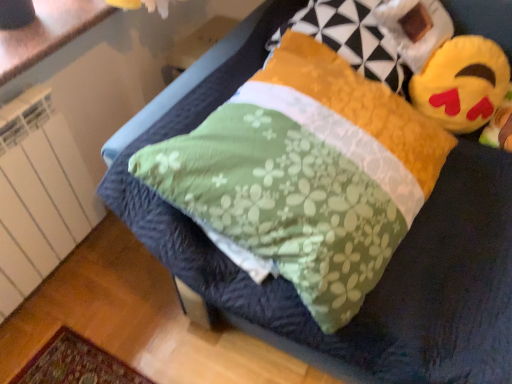
Question: Would you consider white glossy countertop at upper left to be distant from yellow plush toy at upper right?

Choices:
 (A) yes
 (B) no

Answer: (A)

Question: From the image's perspective, would you say white glossy countertop at upper left is shown under yellow plush toy at upper right?

Choices:
 (A) yes
 (B) no

Answer: (B)

Question: Is white glossy countertop at upper left to the left of yellow plush toy at upper right from the viewer's perspective?

Choices:
 (A) no
 (B) yes

Answer: (B)

Question: Is white glossy countertop at upper left bigger than yellow plush toy at upper right?

Choices:
 (A) yes
 (B) no

Answer: (B)

Question: Is white glossy countertop at upper left not inside yellow plush toy at upper right?

Choices:
 (A) yes
 (B) no

Answer: (A)

Question: Is white glossy countertop at upper left bigger or smaller than yellow plush toy at upper right?

Choices:
 (A) big
 (B) small

Answer: (B)

Question: Considering the positions of point (70, 11) and point (466, 102), is point (70, 11) closer or farther from the camera than point (466, 102)?

Choices:
 (A) closer
 (B) farther

Answer: (A)

Question: From the image's perspective, is white glossy countertop at upper left positioned above or below yellow plush toy at upper right?

Choices:
 (A) below
 (B) above

Answer: (B)

Question: Looking at their shapes, would you say white glossy countertop at upper left is wider or thinner than yellow plush toy at upper right?

Choices:
 (A) thin
 (B) wide

Answer: (B)

Question: Is yellow plush toy at upper right inside the boundaries of white glossy countertop at upper left, or outside?

Choices:
 (A) inside
 (B) outside

Answer: (B)

Question: Does point (497, 99) appear closer or farther from the camera than point (96, 23)?

Choices:
 (A) closer
 (B) farther

Answer: (A)

Question: Is yellow plush toy at upper right in front of or behind white glossy countertop at upper left in the image?

Choices:
 (A) behind
 (B) front

Answer: (A)

Question: Is yellow plush toy at upper right wider or thinner than white glossy countertop at upper left?

Choices:
 (A) thin
 (B) wide

Answer: (A)

Question: Considering the positions of fluffy yellow pillow at upper right and yellow plush toy at upper right in the image, is fluffy yellow pillow at upper right taller or shorter than yellow plush toy at upper right?

Choices:
 (A) tall
 (B) short

Answer: (A)

Question: Based on their sizes in the image, would you say fluffy yellow pillow at upper right is bigger or smaller than yellow plush toy at upper right?

Choices:
 (A) small
 (B) big

Answer: (B)